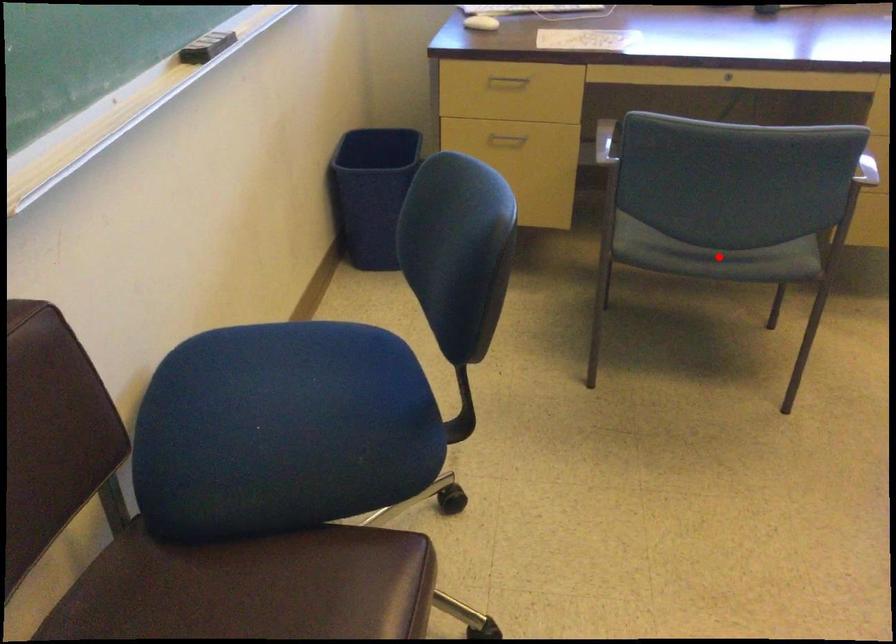
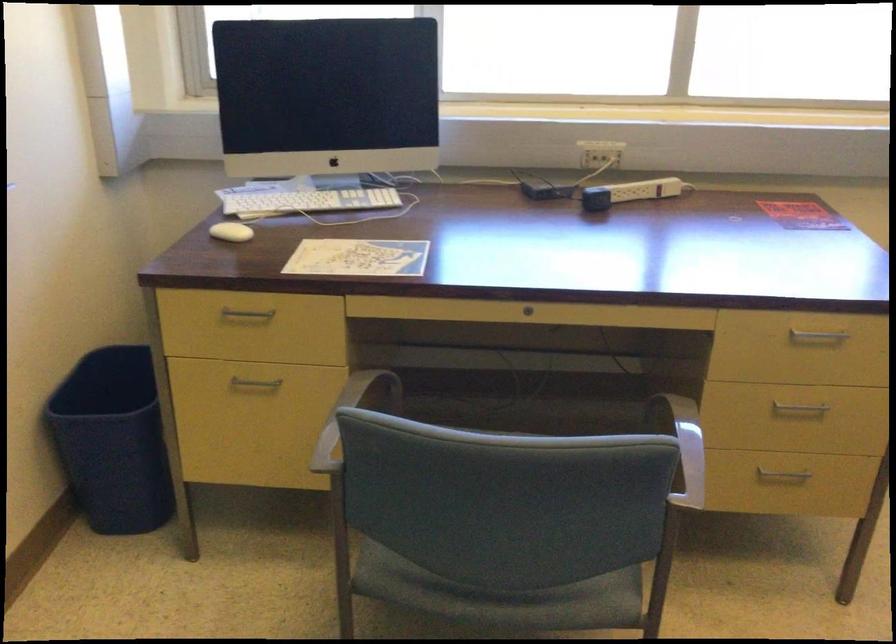
Question: I am providing you with two images of the same scene from different viewpoints. A red point is shown in image1. For the corresponding object point in image2, is it positioned nearer or farther from the camera?

Choices:
 (A) Nearer
 (B) Farther

Answer: (A)